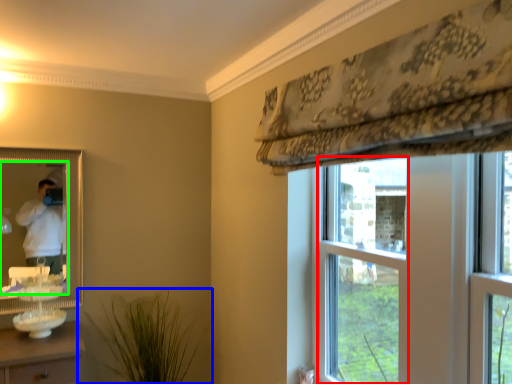
Question: Estimate the real-world distances between objects in this image. Which object is farther from bay window (highlighted by a red box), houseplant (highlighted by a blue box) or mirror (highlighted by a green box)?

Choices:
 (A) houseplant
 (B) mirror

Answer: (B)